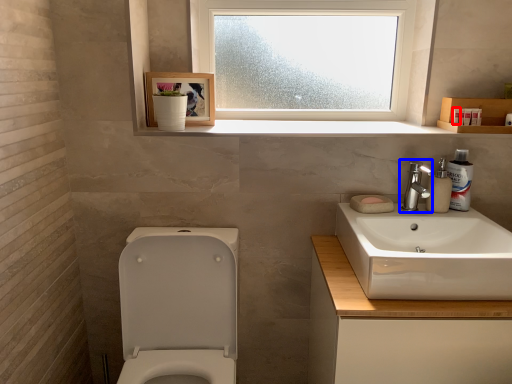
Question: Which object appears farthest to the camera in this image, toiletry (highlighted by a red box) or tap (highlighted by a blue box)?

Choices:
 (A) toiletry
 (B) tap

Answer: (A)